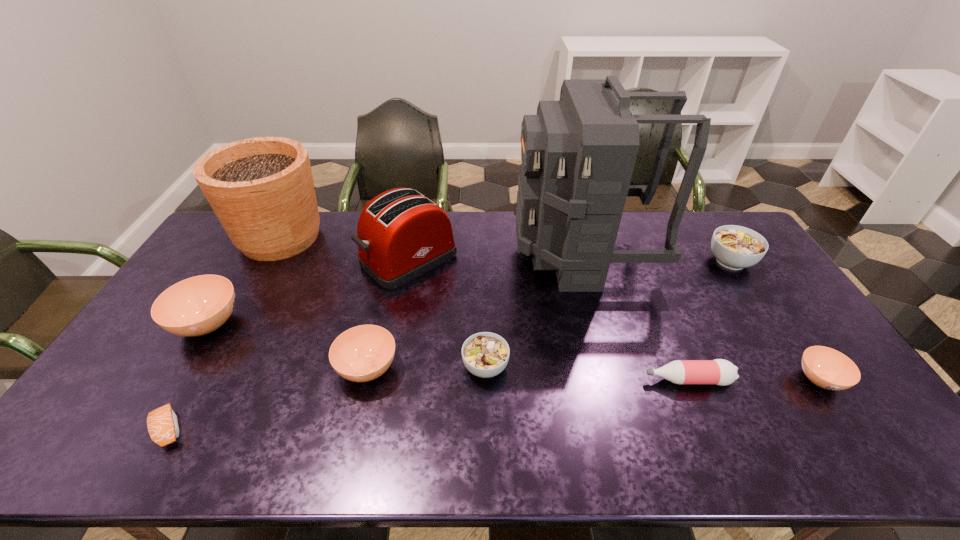
Where is `free region that satisfies the following two spatial constraints: 1. on the front compartment of the shortest soup bowl; 2. on the right side of the tallest object`? free region that satisfies the following two spatial constraints: 1. on the front compartment of the shortest soup bowl; 2. on the right side of the tallest object is located at coordinates (617, 380).

You are a GUI agent. You are given a task and a screenshot of the screen. Output one action in this format:
    pyautogui.click(x=<x>, y=<y>)
    Task: Click on the free location that satisfies the following two spatial constraints: 1. on the front side of the farthest soup bowl; 2. on the right side of the eighth shortest object
    The height and width of the screenshot is (540, 960).
    Given the screenshot: What is the action you would take?
    pyautogui.click(x=408, y=261)